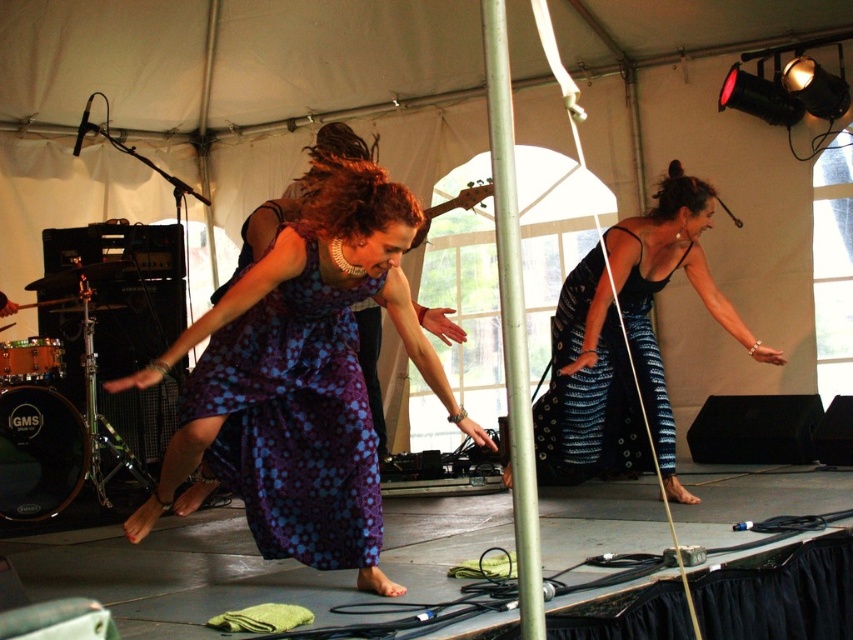
You are a photographer setting up a camera in the tented event space. You need to ensure both the purple dotted dress at center and the black textured dress at right are fully visible in your shot. Given their heights, which dress might require you to adjust your camera angle to avoid cropping?

The purple dotted dress at center is much taller than the black textured dress at right, so you might need to adjust the camera angle to account for its greater height to ensure it isn not cropped.

You are a photographer standing at the entrance of the tented event space. You want to capture a photo that includes both the purple dotted dress at center and the metallic silver bracelet at upper center. Given the distance between them, can you frame both subjects within a standard camera lens with a 50mm focal length?

The distance between the purple dotted dress at center and the metallic silver bracelet at upper center is 9.73 feet. A standard 50mm lens has a field of view that can typically accommodate subjects within this range when positioned appropriately, so yes, both can be framed together.

You are an event photographer standing at the entrance of the tented space. You notice the purple dotted dress at center and the metallic silver bracelet at upper center. Which object is closer to the camera based on their positions?

The metallic silver bracelet at upper center is closer to the camera because it is positioned above the purple dotted dress at center, which is placed underneath it.